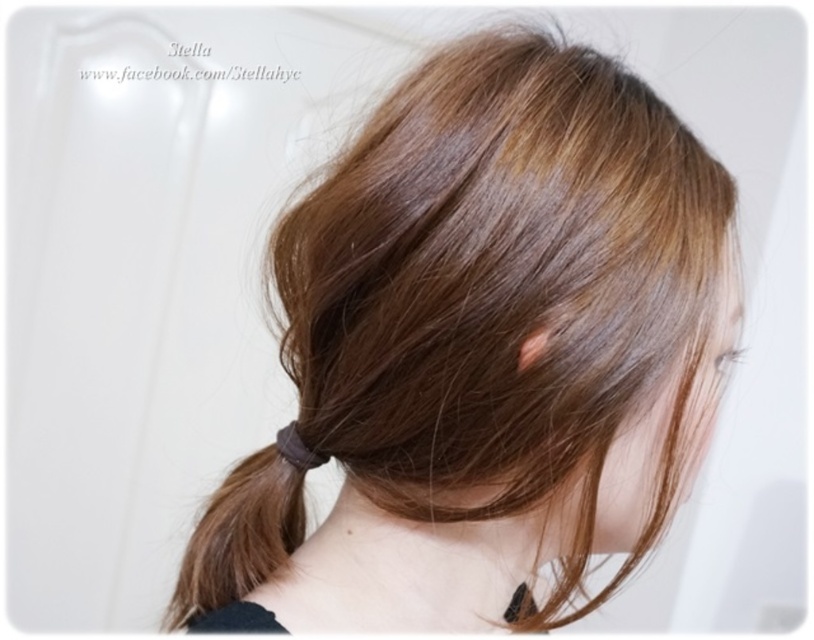
You are a photographer adjusting your camera to focus on the two points in the image. Which point, point (605, 384) or point (295, 524), is closer to the camera?

Point (605, 384) is closer to the camera because it is in front of point (295, 524).

You are a hairstylist assessing a client with a low ponytail. You notice the brown matte hair at center and the brown rubber band at center. Which object is positioned higher up on the head?

The brown matte hair at center is taller than the brown rubber band at center, so the hair is positioned higher up on the head than the rubber band.

You are a hairstylist examining a client with a low ponytail. You need to adjust the position of the brown rubber band at center so it aligns with the brown matte hair at center. Based on the image, which adjustment should you make?

The brown matte hair at center is closer to the viewer than the brown rubber band at center, so you should move the brown rubber band at center forward to align it with the brown matte hair at center.